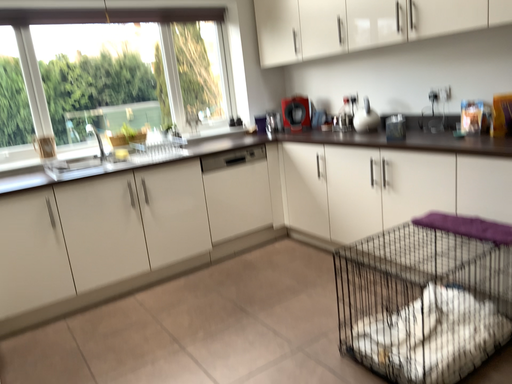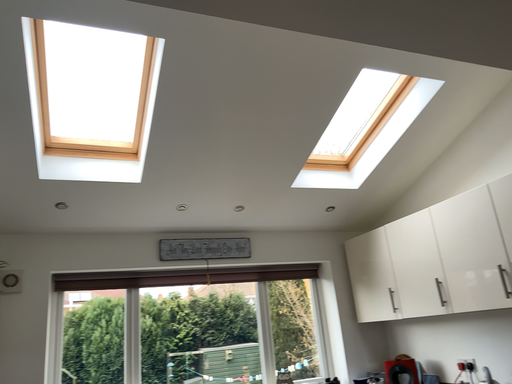
Question: How did the camera likely rotate when shooting the video?

Choices:
 (A) rotated upward
 (B) rotated downward

Answer: (A)